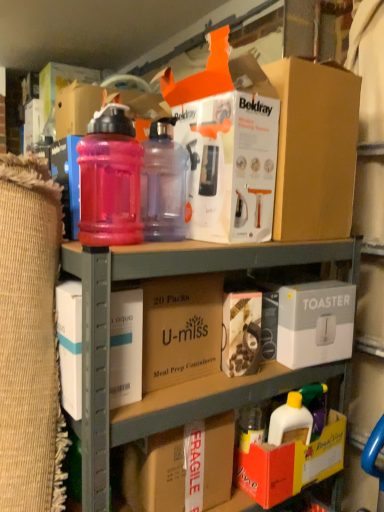
Identify the location of fragile cardboard box at lower center, which appears as the 2th cardboard box when viewed from the top. (182, 468).

Measure the distance between point (155, 376) and camera.

They are 36.14 inches apart.

Describe the element at coordinates (163, 184) in the screenshot. This screenshot has height=512, width=384. I see `pink translucent bottle at upper center, which appears as the 2th bottle when viewed from the left` at that location.

Describe the element at coordinates (314, 150) in the screenshot. The width and height of the screenshot is (384, 512). I see `white cardboard box at upper center, marked as the second box in a left-to-right arrangement` at that location.

You are a GUI agent. You are given a task and a screenshot of the screen. Output one action in this format:
    pyautogui.click(x=<x>, y=<y>)
    Task: Click on the fragile cardboard box at lower center, which appears as the 2th cardboard box when viewed from the top
    The width and height of the screenshot is (384, 512).
    Given the screenshot: What is the action you would take?
    pyautogui.click(x=182, y=468)

At what (x,y) coordinates should I click in order to perform the action: click on the 2nd bottle in front of the fragile cardboard box at lower center, which appears as the 2th cardboard box when viewed from the top. Please return your answer as a coordinate pair (x, y). This screenshot has height=512, width=384. Looking at the image, I should click on (110, 180).

Is fragile cardboard box at lower center, acting as the first cardboard box starting from the bottom, aimed at translucent pink bottle at upper left, acting as the 1th bottle starting from the left?

No, fragile cardboard box at lower center, acting as the first cardboard box starting from the bottom, is not oriented towards translucent pink bottle at upper left, acting as the 1th bottle starting from the left.

Is point (159, 444) closer or farther from the camera than point (114, 133)?

Clearly, point (159, 444) is more distant from the camera than point (114, 133).

Considering the points (79, 227) and (305, 307), which point is in front, point (79, 227) or point (305, 307)?

The point (79, 227) is closer.

Can you confirm if translucent pink bottle at upper left, acting as the 1th bottle starting from the left, is shorter than white cardboard toaster at lower right?

No.

Consider the image. Considering the positions of objects translucent pink bottle at upper left, acting as the 1th bottle starting from the left, and white cardboard toaster at lower right in the image provided, who is more to the left, translucent pink bottle at upper left, acting as the 1th bottle starting from the left, or white cardboard toaster at lower right?

translucent pink bottle at upper left, acting as the 1th bottle starting from the left.

Identify the location of shelf located below the fragile cardboard box at lower center, which appears as the 2th cardboard box when viewed from the top (from the image's perspective). The width and height of the screenshot is (384, 512). (182, 383).

Consider the image. Which is more distant, (202, 429) or (130, 433)?

The point (202, 429) is farther from the camera.

Does fragile cardboard box at lower center, which appears as the 2th cardboard box when viewed from the top, contain pink plastic bottles at upper center?

Actually, pink plastic bottles at upper center is outside fragile cardboard box at lower center, which appears as the 2th cardboard box when viewed from the top.

Is fragile cardboard box at lower center, acting as the first cardboard box starting from the bottom, facing away from pink plastic bottles at upper center?

Yes, fragile cardboard box at lower center, acting as the first cardboard box starting from the bottom, is positioned with its back facing pink plastic bottles at upper center.

From a real-world perspective, which object stands above the other?

translucent pink bottle at upper left, acting as the 1th bottle starting from the left.

Does point (106, 150) come in front of point (183, 397)?

Yes, point (106, 150) is closer to viewer.

Find the location of a particular element. Image resolution: width=384 pixels, height=512 pixels. shelf in front of the translucent pink bottle at upper left, acting as the 1th bottle starting from the left is located at coordinates (182, 383).

Considering the sizes of objects translucent pink bottle at upper left, acting as the 1th bottle starting from the left, and pink plastic bottles at upper center in the image provided, who is thinner, translucent pink bottle at upper left, acting as the 1th bottle starting from the left, or pink plastic bottles at upper center?

Thinner between the two is translucent pink bottle at upper left, acting as the 1th bottle starting from the left.

Can you confirm if white cardboard toaster at lower right is positioned to the right of white cardboard box at left, placed as the 2th box when sorted from back to front?

Indeed, white cardboard toaster at lower right is positioned on the right side of white cardboard box at left, placed as the 2th box when sorted from back to front.

Is white cardboard toaster at lower right beside white cardboard box at left, marked as the first box in a bottom-to-top arrangement?

No, white cardboard toaster at lower right is not in contact with white cardboard box at left, marked as the first box in a bottom-to-top arrangement.

Which is less distant, (x=308, y=331) or (x=122, y=398)?

The point (x=122, y=398) is more forward.

From the image's perspective, starting from the brown cardboard at center, which is counted as the 2th cardboard box, starting from the bottom, which bottle is the 1st one above? Please provide its 2D coordinates.

[(110, 180)]

Does translucent pink bottle at upper left, which is the second bottle in right-to-left order, come behind brown cardboard at center, which is counted as the 2th cardboard box, starting from the bottom?

No, it is not.

Is translucent pink bottle at upper left, acting as the 1th bottle starting from the left, bigger than brown cardboard at center, which is counted as the 2th cardboard box, starting from the bottom?

No, translucent pink bottle at upper left, acting as the 1th bottle starting from the left, is not bigger than brown cardboard at center, which is counted as the 2th cardboard box, starting from the bottom.

Is translucent pink bottle at upper left, acting as the 1th bottle starting from the left, wider than brown cardboard at center, the 1th cardboard box from the top?

Incorrect, the width of translucent pink bottle at upper left, acting as the 1th bottle starting from the left, does not surpass that of brown cardboard at center, the 1th cardboard box from the top.

Consider the image. Considering the sizes of objects white cardboard box at left, marked as the first box in a bottom-to-top arrangement, and pink translucent bottle at upper center, which is the first bottle in right-to-left order, in the image provided, who is thinner, white cardboard box at left, marked as the first box in a bottom-to-top arrangement, or pink translucent bottle at upper center, which is the first bottle in right-to-left order,?

With smaller width is white cardboard box at left, marked as the first box in a bottom-to-top arrangement.

Is white cardboard box at left, which is the second box in top-to-bottom order, to the left of pink translucent bottle at upper center, which is the first bottle in right-to-left order, from the viewer's perspective?

Yes.

Which of these two, white cardboard box at left, placed as the 2th box when sorted from back to front, or pink translucent bottle at upper center, which is the first bottle in right-to-left order, stands shorter?

With less height is white cardboard box at left, placed as the 2th box when sorted from back to front.

Measure the distance from white cardboard box at left, which is the first box in left-to-right order, to pink translucent bottle at upper center, which is the first bottle in right-to-left order.

white cardboard box at left, which is the first box in left-to-right order, is 11.13 inches from pink translucent bottle at upper center, which is the first bottle in right-to-left order.

At what (x,y) coordinates should I click in order to perform the action: click on the 2nd cardboard box below when counting from the translucent pink bottle at upper left, acting as the 1th bottle starting from the left (from the image's perspective). Please return your answer as a coordinate pair (x, y). Looking at the image, I should click on (182, 468).

What are the coordinates of `storage box below the translucent pink bottle at upper left, acting as the 1th bottle starting from the left (from a real-world perspective)` in the screenshot? It's located at (315, 323).

From the image, which object appears to be nearer to translucent pink bottle at upper left, acting as the 1th bottle starting from the left, white cardboard box at left, which is counted as the 1th box, starting from the front, or brown cardboard at center, which is counted as the 2th cardboard box, starting from the bottom?

Based on the image, white cardboard box at left, which is counted as the 1th box, starting from the front, appears to be nearer to translucent pink bottle at upper left, acting as the 1th bottle starting from the left.

Estimate the real-world distances between objects in this image. Which object is closer to pink plastic bottles at upper center, white cardboard box at left, placed as the 2th box when sorted from back to front, or translucent pink bottle at upper left, which is the second bottle in right-to-left order?

The object closer to pink plastic bottles at upper center is white cardboard box at left, placed as the 2th box when sorted from back to front.

Consider the image. Which object lies further to the anchor point white cardboard box at left, marked as the first box in a bottom-to-top arrangement, pink translucent bottle at upper center, which is the first bottle in right-to-left order, or white cardboard toaster at lower right?

Among the two, white cardboard toaster at lower right is located further to white cardboard box at left, marked as the first box in a bottom-to-top arrangement.

From the image, which object appears to be farther from white cardboard box at left, marked as the first box in a bottom-to-top arrangement, white cardboard box at upper center, which is the 1th box from top to bottom, or white cardboard toaster at lower right?

Among the two, white cardboard box at upper center, which is the 1th box from top to bottom, is located further to white cardboard box at left, marked as the first box in a bottom-to-top arrangement.

In the scene shown: Looking at the image, which one is located closer to pink translucent bottle at upper center, which is the first bottle in right-to-left order, pink plastic bottles at upper center or white cardboard box at upper center, the 1th box from the right?

The object closer to pink translucent bottle at upper center, which is the first bottle in right-to-left order, is pink plastic bottles at upper center.

Estimate the real-world distances between objects in this image. Which object is further from brown cardboard at center, the 1th cardboard box from the top, white cardboard box at left, which is counted as the 1th box, starting from the front, or white cardboard toaster at lower right?

white cardboard toaster at lower right.

Looking at the image, which one is located further to fragile cardboard box at lower center, acting as the first cardboard box starting from the bottom, white cardboard box at left, which is the second box in top-to-bottom order, or brown cardboard at center, which is counted as the 2th cardboard box, starting from the bottom?

Among the two, white cardboard box at left, which is the second box in top-to-bottom order, is located further to fragile cardboard box at lower center, acting as the first cardboard box starting from the bottom.

Consider the image. Estimate the real-world distances between objects in this image. Which object is further from white cardboard toaster at lower right, translucent pink bottle at upper left, acting as the 1th bottle starting from the left, or fragile cardboard box at lower center, which appears as the 2th cardboard box when viewed from the top?

translucent pink bottle at upper left, acting as the 1th bottle starting from the left, is further to white cardboard toaster at lower right.

The width and height of the screenshot is (384, 512). Identify the location of bottle between pink translucent bottle at upper center, which appears as the 2th bottle when viewed from the left, and pink plastic bottles at upper center in the up-down direction. pos(110,180).

This screenshot has height=512, width=384. What are the coordinates of `box between white cardboard box at upper center, the 1th box from the right, and pink plastic bottles at upper center, in the vertical direction` in the screenshot? It's located at tap(126, 347).

Where is `cardboard box between brown cardboard at center, the 1th cardboard box from the top, and white cardboard toaster at lower right`? cardboard box between brown cardboard at center, the 1th cardboard box from the top, and white cardboard toaster at lower right is located at coordinates (182, 468).

Identify the location of cardboard box between white cardboard box at upper center, the 1th box from the right, and white cardboard toaster at lower right, in the vertical direction. The image size is (384, 512). (181, 329).